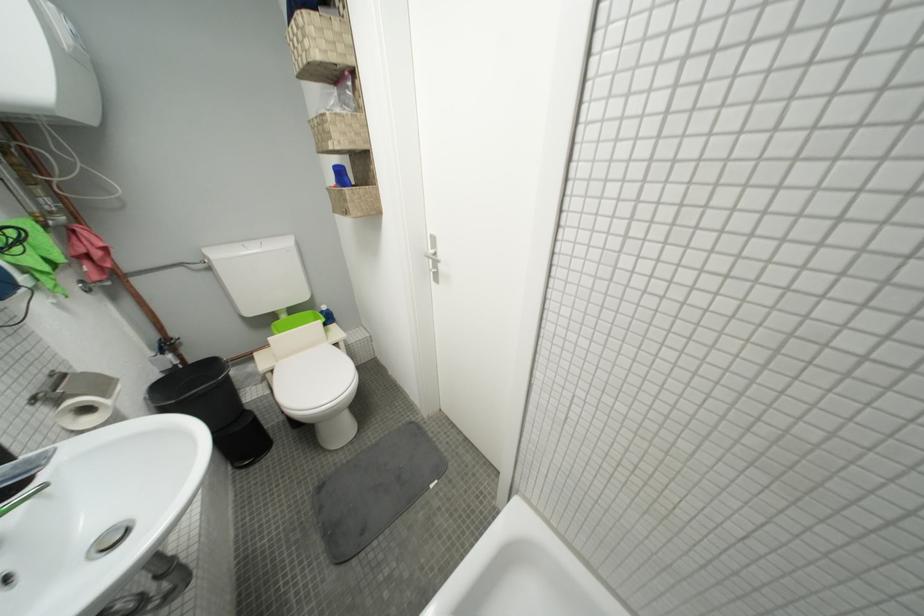
Where is `blue valve lever`? blue valve lever is located at coordinates (167, 345).